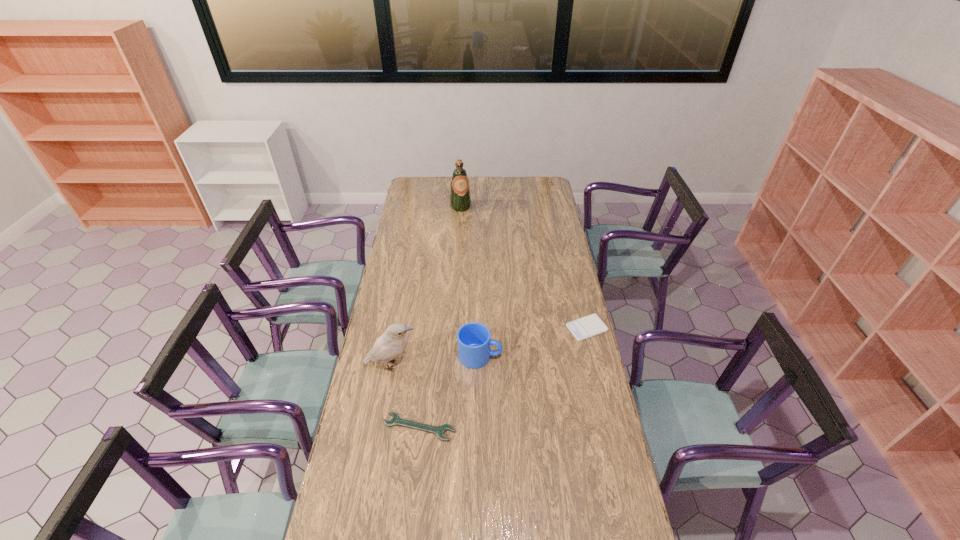
The width and height of the screenshot is (960, 540). I want to click on wrench, so [x=439, y=431].

Image resolution: width=960 pixels, height=540 pixels. I want to click on the rightmost object, so click(x=583, y=328).

The image size is (960, 540). I want to click on calculator, so click(x=583, y=328).

Find the location of a particular element. bird is located at coordinates (388, 346).

This screenshot has width=960, height=540. What are the coordinates of `olive oil` in the screenshot? It's located at (460, 200).

The image size is (960, 540). In order to click on the tallest object in this screenshot , I will do `click(460, 200)`.

Where is `the third tallest object`? This screenshot has width=960, height=540. the third tallest object is located at coordinates (474, 339).

This screenshot has width=960, height=540. Find the location of `free space located 0.100m on the front of the nearest object`. free space located 0.100m on the front of the nearest object is located at coordinates (414, 470).

The image size is (960, 540). I want to click on free space located 0.130m on the left of the second farthest object, so click(x=537, y=328).

This screenshot has height=540, width=960. What are the coordinates of `vacant space situated 0.260m at the beak of the second tallest object` in the screenshot? It's located at (483, 363).